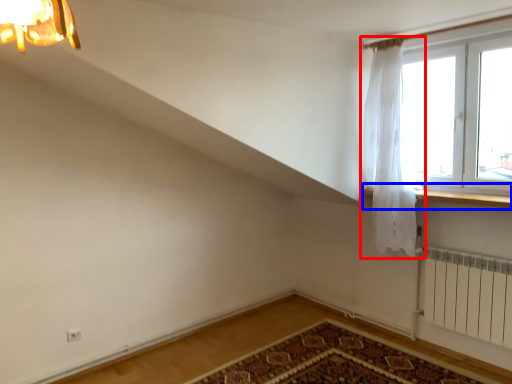
Question: Which of the following is the farthest to the observer, curtain (highlighted by a red box) or window sill (highlighted by a blue box)?

Choices:
 (A) curtain
 (B) window sill

Answer: (A)